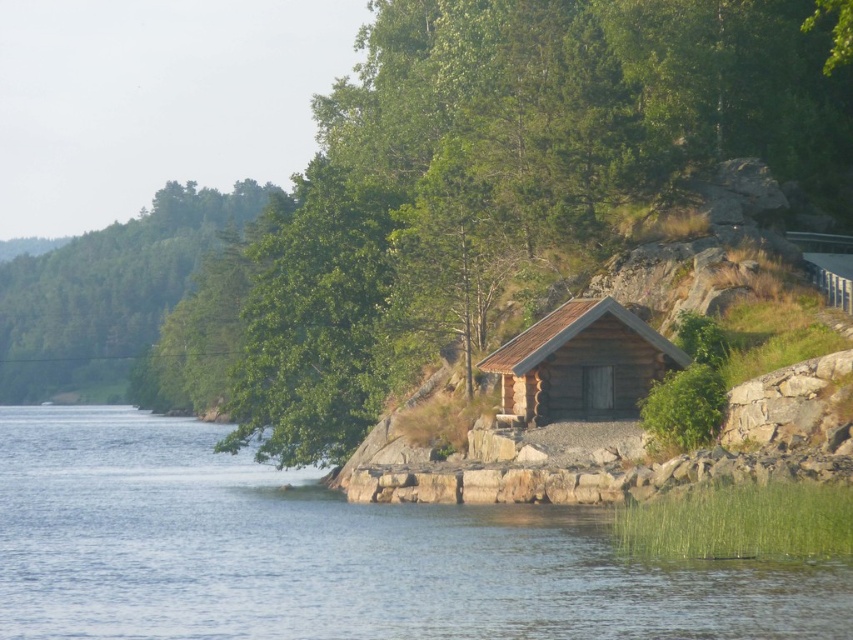
Question: Is transparent blue water at lower left above brown wooden log cabin at center-right?

Choices:
 (A) yes
 (B) no

Answer: (B)

Question: Which point appears closest to the camera in this image?

Choices:
 (A) (213, 241)
 (B) (331, 570)

Answer: (B)

Question: Can you confirm if transparent blue water at lower left is bigger than brown wooden log cabin at center-right?

Choices:
 (A) yes
 (B) no

Answer: (A)

Question: Estimate the real-world distances between objects in this image. Which object is farther from the transparent blue water at lower left?

Choices:
 (A) brown wooden log cabin at center-right
 (B) green leafy tree at left

Answer: (B)

Question: Does green leafy tree at left come behind brown wooden log cabin at center-right?

Choices:
 (A) yes
 (B) no

Answer: (A)

Question: Which object is farther from the camera taking this photo?

Choices:
 (A) brown wooden log cabin at center-right
 (B) transparent blue water at lower left

Answer: (A)